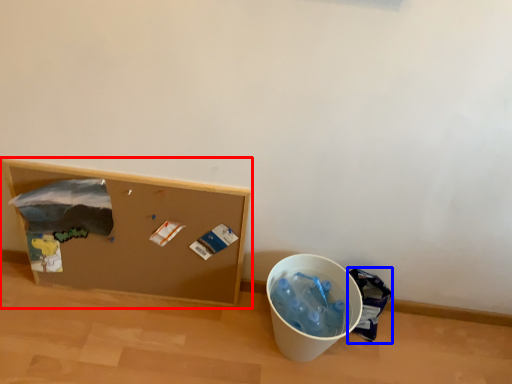
Question: Which object appears farthest to the camera in this image, furniture (highlighted by a red box) or garbage (highlighted by a blue box)?

Choices:
 (A) furniture
 (B) garbage

Answer: (B)